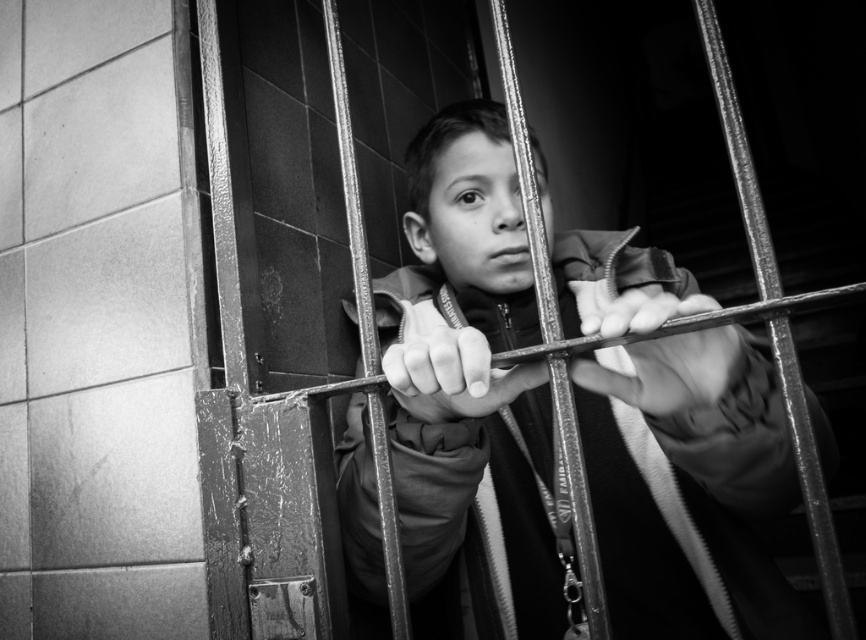
You are a photographer analyzing this image. You notice the matte black jacket at center and the smooth metal hand at center. Based on their sizes in the photo, which object would appear closer to the camera?

The matte black jacket at center is bigger than the smooth metal hand at center, so the matte black jacket at center appears closer to the camera since larger objects in the same frame typically indicate proximity.

You are a photographer analyzing this image. You notice two points in the scene at coordinates point (619, 550) and point (708, 372). Based on their positions, which point is closer to the camera?

Point (708, 372) is closer to the camera than point (619, 550) because the description states that point (619, 550) is further away.